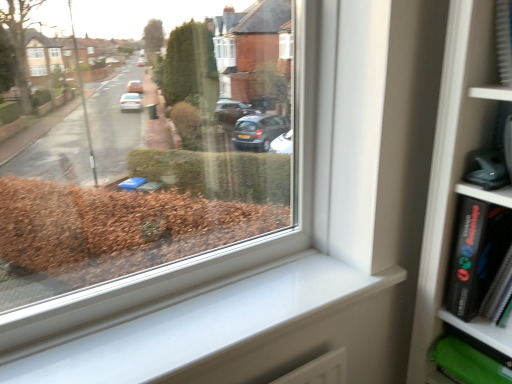
Question: Can you confirm if black matte book at right is positioned to the right of white smooth window sill at lower right?

Choices:
 (A) no
 (B) yes

Answer: (B)

Question: From the image's perspective, is black matte book at right below white smooth window sill at lower right?

Choices:
 (A) yes
 (B) no

Answer: (B)

Question: Is black matte book at right completely or partially outside of white smooth window sill at lower right?

Choices:
 (A) no
 (B) yes

Answer: (B)

Question: Does black matte book at right come behind white smooth window sill at lower right?

Choices:
 (A) yes
 (B) no

Answer: (A)

Question: Is black matte book at right turned away from white smooth window sill at lower right?

Choices:
 (A) no
 (B) yes

Answer: (A)

Question: Does black matte book at right have a lesser width compared to white smooth window sill at lower right?

Choices:
 (A) yes
 (B) no

Answer: (A)

Question: From a real-world perspective, is white smooth window sill at lower right positioned under black matte book at right based on gravity?

Choices:
 (A) no
 (B) yes

Answer: (B)

Question: From a real-world perspective, is white smooth window sill at lower right physically above black matte book at right?

Choices:
 (A) yes
 (B) no

Answer: (B)

Question: Can you confirm if white smooth window sill at lower right is shorter than black matte book at right?

Choices:
 (A) no
 (B) yes

Answer: (B)

Question: Is white smooth window sill at lower right touching black matte book at right?

Choices:
 (A) yes
 (B) no

Answer: (B)

Question: Is white smooth window sill at lower right outside black matte book at right?

Choices:
 (A) no
 (B) yes

Answer: (B)

Question: Is the position of white smooth window sill at lower right more distant than that of black matte book at right?

Choices:
 (A) yes
 (B) no

Answer: (B)

Question: Is point (465, 271) positioned closer to the camera than point (330, 347)?

Choices:
 (A) closer
 (B) farther

Answer: (A)